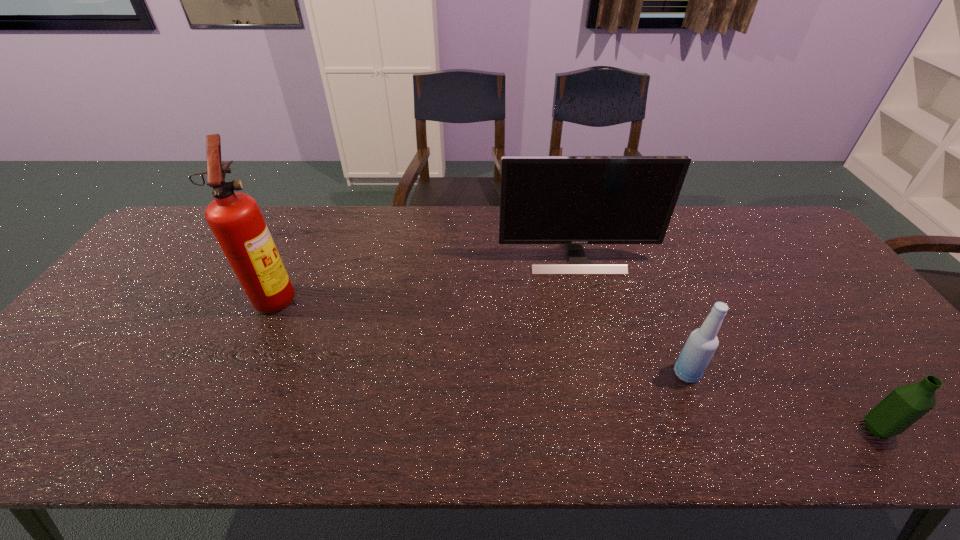
I want to click on vacant area between the monitor and the third tallest object, so click(632, 315).

Find the location of `vacant space that is in between the third nearest object and the second shortest object`. vacant space that is in between the third nearest object and the second shortest object is located at coordinates (481, 335).

Where is `object that stands as the second closest to the rightmost object`? The width and height of the screenshot is (960, 540). object that stands as the second closest to the rightmost object is located at coordinates (573, 200).

Identify the location of object that is the second closest one to the second farthest object. The height and width of the screenshot is (540, 960). (702, 343).

The width and height of the screenshot is (960, 540). I want to click on vacant area that satisfies the following two spatial constraints: 1. on the screen side of the monitor; 2. on the left side of the nearest object, so click(x=618, y=429).

At what (x,y) coordinates should I click in order to perform the action: click on vacant area in the image that satisfies the following two spatial constraints: 1. on the screen side of the monitor; 2. on the right side of the shortest object. Please return your answer as a coordinate pair (x, y). Looking at the image, I should click on (618, 429).

Image resolution: width=960 pixels, height=540 pixels. Find the location of `free space in the image that satisfies the following two spatial constraints: 1. on the screen side of the third shortest object; 2. on the front-facing side of the third nearest object`. free space in the image that satisfies the following two spatial constraints: 1. on the screen side of the third shortest object; 2. on the front-facing side of the third nearest object is located at coordinates (586, 296).

You are a GUI agent. You are given a task and a screenshot of the screen. Output one action in this format:
    pyautogui.click(x=<x>, y=<y>)
    Task: Click on the vacant region that satisfies the following two spatial constraints: 1. on the back side of the rightmost object; 2. on the front-facing side of the third nearest object
    The height and width of the screenshot is (540, 960).
    Given the screenshot: What is the action you would take?
    pyautogui.click(x=784, y=296)

In order to click on free spot that satisfies the following two spatial constraints: 1. on the screen side of the third shortest object; 2. on the right side of the rightmost object in this screenshot , I will do `click(618, 429)`.

The image size is (960, 540). Find the location of `free region that satisfies the following two spatial constraints: 1. on the screen side of the nearest object; 2. on the right side of the farthest object`. free region that satisfies the following two spatial constraints: 1. on the screen side of the nearest object; 2. on the right side of the farthest object is located at coordinates (618, 429).